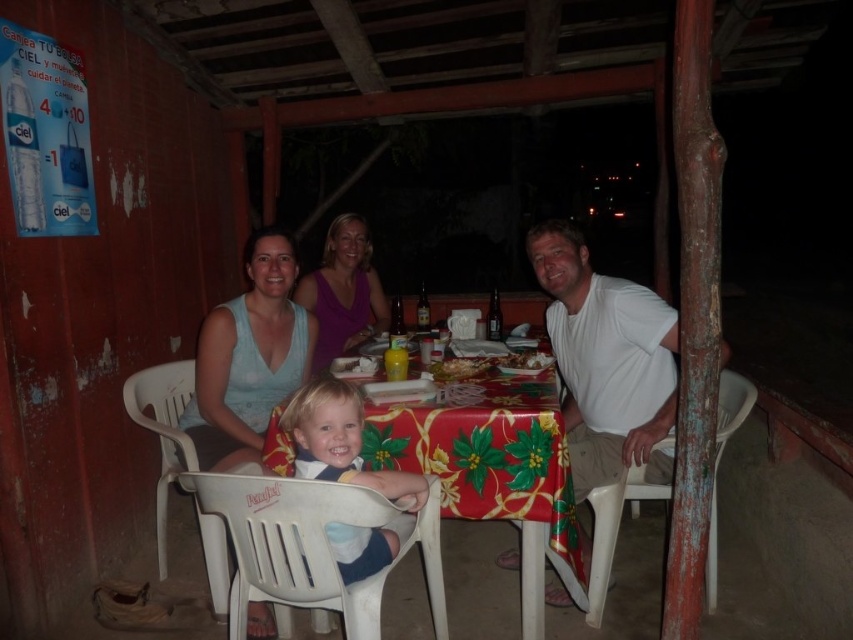
Question: Based on their relative distances, which object is nearer to the white cotton shirt at right?

Choices:
 (A) floral tablecloth at center
 (B) golden brown pastry at center
 (C) blonde hair plastic chair at lower center
 (D) light blue fabric dress at center

Answer: (A)

Question: Does white cotton shirt at right have a greater width compared to blonde hair plastic chair at lower center?

Choices:
 (A) yes
 (B) no

Answer: (A)

Question: Estimate the real-world distances between objects in this image. Which object is closer to the floral tablecloth at center?

Choices:
 (A) smooth plastic chair at center
 (B) shiny plastic bowl at center

Answer: (B)

Question: Can you confirm if blonde hair plastic chair at lower center is positioned to the right of floral tablecloth at center?

Choices:
 (A) yes
 (B) no

Answer: (B)

Question: Can you confirm if smooth plastic chair at center is positioned to the right of shiny plastic bowl at center?

Choices:
 (A) no
 (B) yes

Answer: (B)

Question: Which object appears farthest from the camera in this image?

Choices:
 (A) light blue fabric dress at center
 (B) shiny plastic bowl at center

Answer: (B)